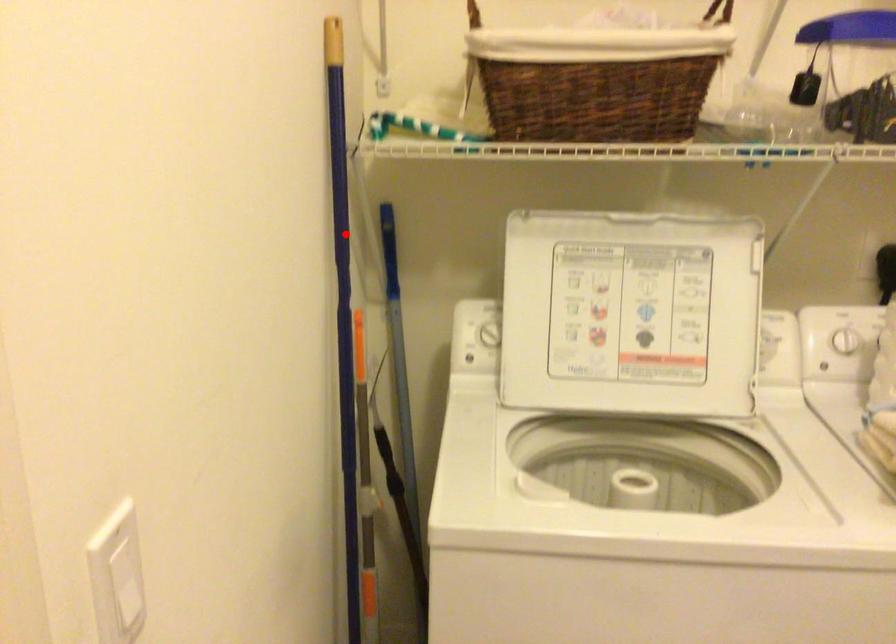
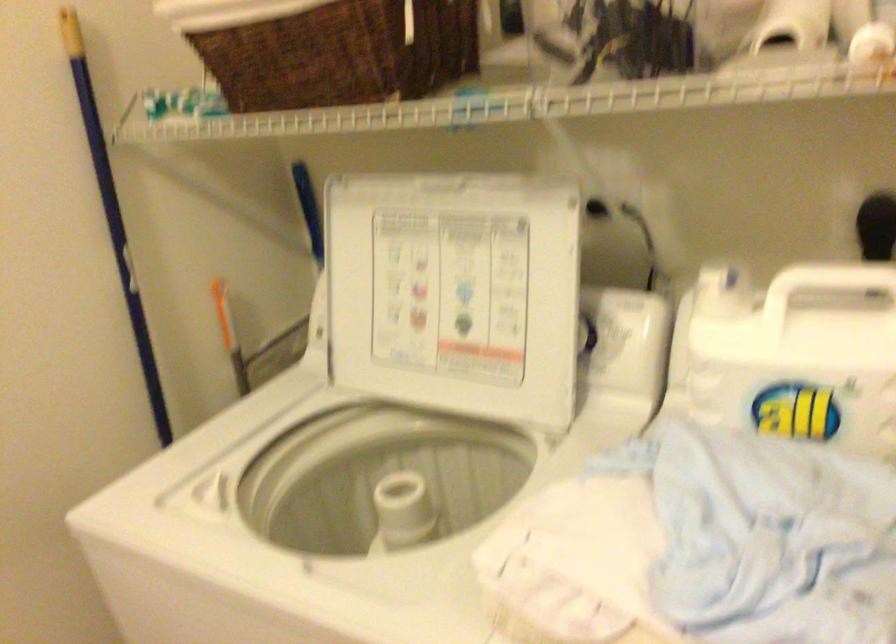
Find the pixel in the second image that matches the highlighted location in the first image.

(113, 216)